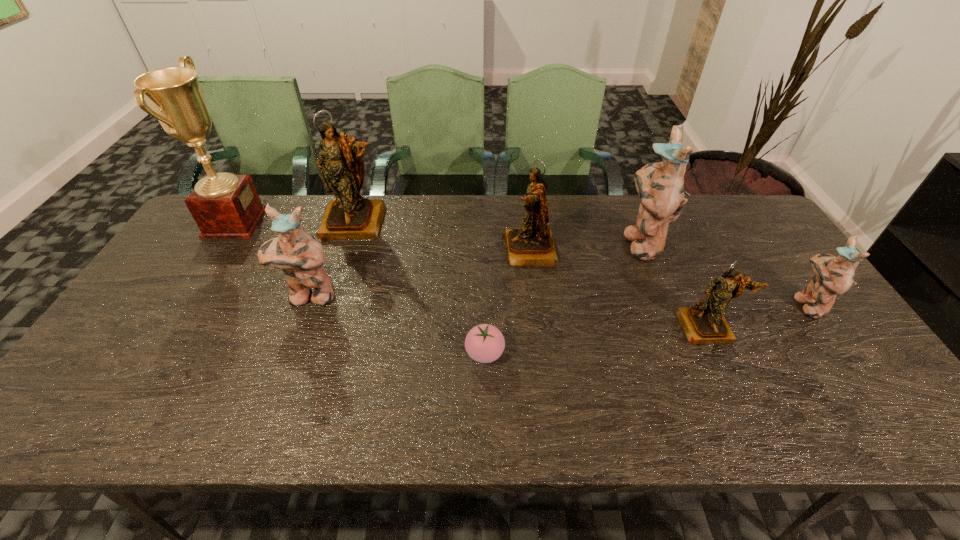
Identify the location of empty space that is in between the rightmost pink figurine and the biggest gold figurine. The image size is (960, 540). (581, 264).

Identify the location of vacant point located between the rightmost pink figurine and the rightmost gold figurine. (757, 315).

The height and width of the screenshot is (540, 960). I want to click on free spot between the tomato and the smallest gold figurine, so click(596, 340).

Point out which object is positioned as the sixth nearest to the trophy cup. Please provide its 2D coordinates. Your answer should be formatted as a tuple, i.e. [(x, y)], where the tuple contains the x and y coordinates of a point satisfying the conditions above.

[(704, 322)]

Find the location of `object that is the sixth closest to the trophy cup`. object that is the sixth closest to the trophy cup is located at coordinates (704, 322).

Find the location of a particular element. the fourth closest figurine to the leftmost pink figurine is located at coordinates (704, 322).

At what (x,y) coordinates should I click in order to perform the action: click on figurine identified as the fourth closest to the rightmost gold figurine. Please return your answer as a coordinate pair (x, y). Image resolution: width=960 pixels, height=540 pixels. Looking at the image, I should click on (350, 216).

Point out which pink figurine is positioned as the nearest to the tomato. Please provide its 2D coordinates. Your answer should be formatted as a tuple, i.e. [(x, y)], where the tuple contains the x and y coordinates of a point satisfying the conditions above.

[(300, 256)]

Locate an element on the screen. This screenshot has width=960, height=540. pink figurine that is the third closest one to the biggest gold figurine is located at coordinates (833, 276).

Locate an element on the screen. This screenshot has width=960, height=540. gold figurine object that ranks as the second closest to the fourth object from left to right is located at coordinates (350, 216).